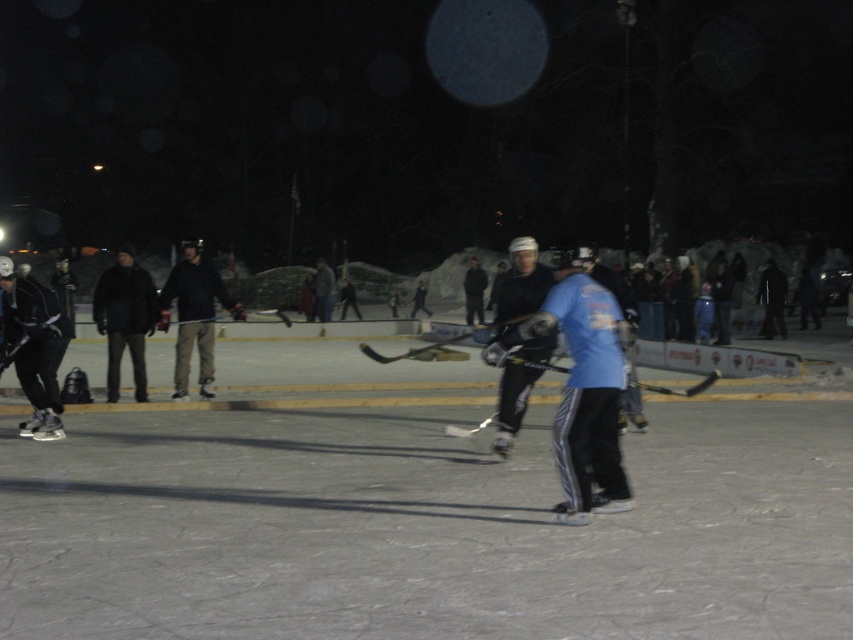
Question: Which of the following is the closest to the observer?

Choices:
 (A) (206, 392)
 (B) (152, 289)
 (C) (595, 307)
 (D) (532, 362)

Answer: (C)

Question: From the image, what is the correct spatial relationship of dark gray pants at center in relation to black matte hockey stick at center?

Choices:
 (A) above
 (B) below

Answer: (A)

Question: Which of the following is the farthest from the observer?

Choices:
 (A) smooth ice rink at center
 (B) dark gray pants at center
 (C) black matte hockey stick at center
 (D) blue fabric shirt at center

Answer: (B)

Question: Is smooth ice rink at center wider than black matte jacket at left?

Choices:
 (A) no
 (B) yes

Answer: (B)

Question: Which object is closer to the camera taking this photo?

Choices:
 (A) black matte jacket at left
 (B) black matte hockey stick at center

Answer: (B)

Question: Can you confirm if blue fabric shirt at center is positioned below black matte hockey stick at center?

Choices:
 (A) yes
 (B) no

Answer: (B)